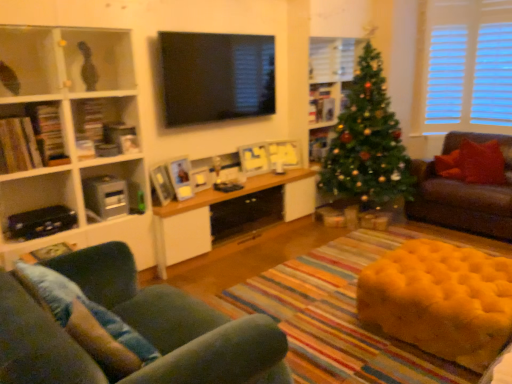
Question: Is wooden cabinet at center smaller than velvet green sofa at lower left, the second studio couch in the right-to-left sequence?

Choices:
 (A) no
 (B) yes

Answer: (A)

Question: From a real-world perspective, is wooden cabinet at center over velvet green sofa at lower left, the first studio couch when ordered from left to right?

Choices:
 (A) no
 (B) yes

Answer: (A)

Question: Could you tell me if wooden cabinet at center is turned towards velvet green sofa at lower left, acting as the second studio couch starting from the top?

Choices:
 (A) no
 (B) yes

Answer: (A)

Question: From the image's perspective, is wooden cabinet at center below velvet green sofa at lower left, acting as the second studio couch starting from the top?

Choices:
 (A) yes
 (B) no

Answer: (B)

Question: Is the surface of wooden cabinet at center in direct contact with velvet green sofa at lower left, positioned as the first studio couch in front-to-back order?

Choices:
 (A) yes
 (B) no

Answer: (B)

Question: Which is correct: brown leather couch at right, arranged as the first studio couch when viewed from the right, is inside yellow tufted ottoman at lower right, or outside of it?

Choices:
 (A) inside
 (B) outside

Answer: (B)

Question: Visually, is brown leather couch at right, which ranks as the 1th studio couch in back-to-front order, positioned to the left or to the right of yellow tufted ottoman at lower right?

Choices:
 (A) left
 (B) right

Answer: (B)

Question: Is brown leather couch at right, the second studio couch when ordered from front to back, in front of or behind yellow tufted ottoman at lower right in the image?

Choices:
 (A) behind
 (B) front

Answer: (A)

Question: Considering the positions of brown leather couch at right, which ranks as the 1th studio couch in back-to-front order, and yellow tufted ottoman at lower right in the image, is brown leather couch at right, which ranks as the 1th studio couch in back-to-front order, taller or shorter than yellow tufted ottoman at lower right?

Choices:
 (A) tall
 (B) short

Answer: (A)

Question: Is wooden cabinet at center inside the boundaries of brown leather couch at right, the second studio couch when ordered from front to back, or outside?

Choices:
 (A) inside
 (B) outside

Answer: (B)

Question: From a real-world perspective, is wooden cabinet at center above or below brown leather couch at right, which ranks as the 1th studio couch in back-to-front order?

Choices:
 (A) below
 (B) above

Answer: (A)

Question: From the image's perspective, is wooden cabinet at center located above or below brown leather couch at right, the second studio couch when ordered from front to back?

Choices:
 (A) below
 (B) above

Answer: (A)

Question: Does point (161, 218) appear closer or farther from the camera than point (456, 208)?

Choices:
 (A) farther
 (B) closer

Answer: (B)

Question: Looking at their shapes, would you say yellow tufted ottoman at lower right is wider or thinner than matte white bookshelf at left, marked as the fourth shelf in a right-to-left arrangement?

Choices:
 (A) thin
 (B) wide

Answer: (B)

Question: Choose the correct answer: Is yellow tufted ottoman at lower right inside matte white bookshelf at left, which is the first shelf from front to back, or outside it?

Choices:
 (A) outside
 (B) inside

Answer: (A)